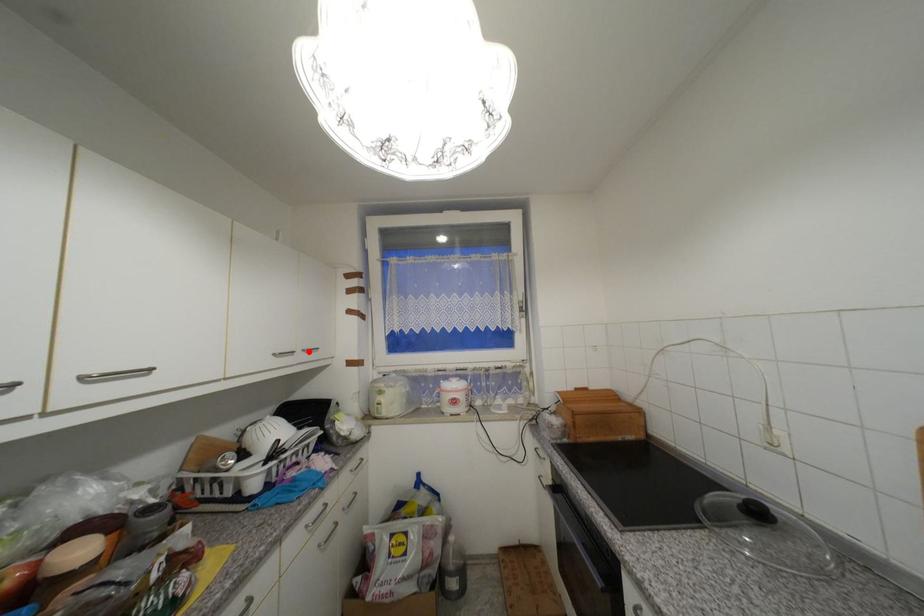
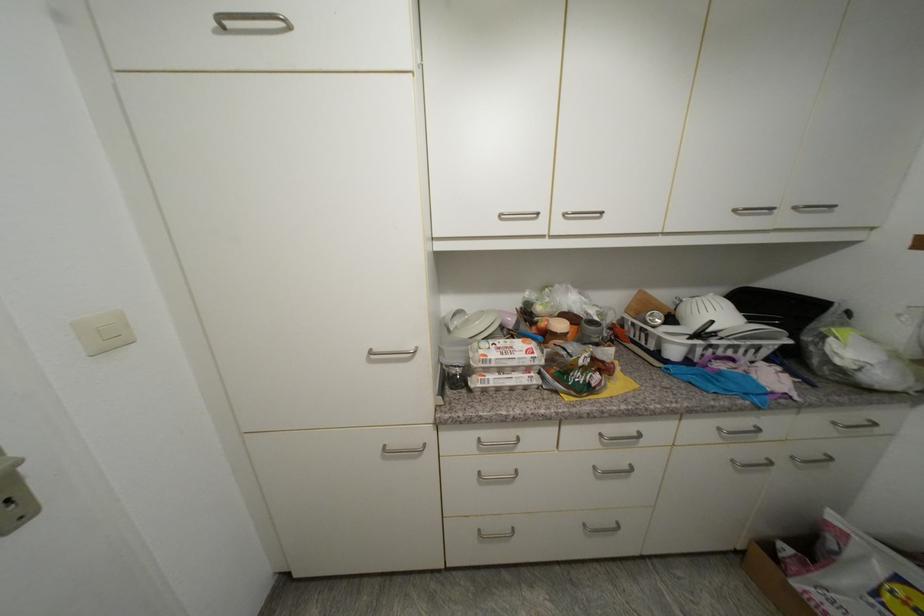
The point at the highlighted location is marked in the first image. Where is the corresponding point in the second image?

(800, 209)